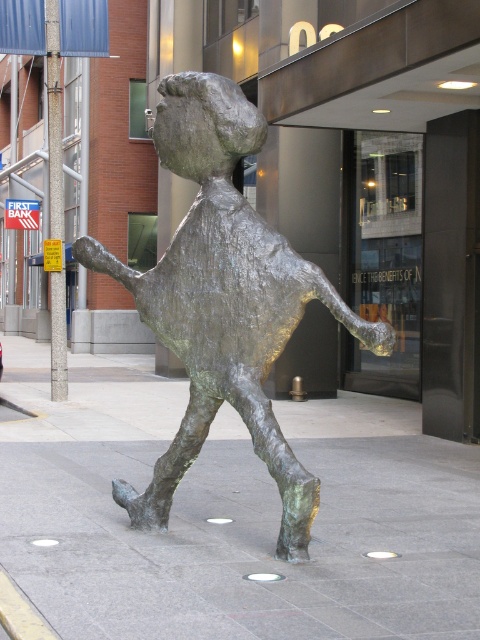
From the picture: You are a city planner assessing the placement of the bronze statue at center and the green patina pavement at center. Based on their positions, which object is located lower in the scene?

The green patina pavement at center is below the bronze statue at center, so it is located lower in the scene.

You are a delivery person with a cart that is 3 meters wide. You need to navigate through the space between the green patina pavement at center and bronze statue at center. Can your cart fit through the space between them?

The space between the green patina pavement at center and bronze statue at center is 2.82 meters. Since the cart is 3 meters wide, it is slightly wider than the available space. Therefore, the cart cannot fit through the space between them.